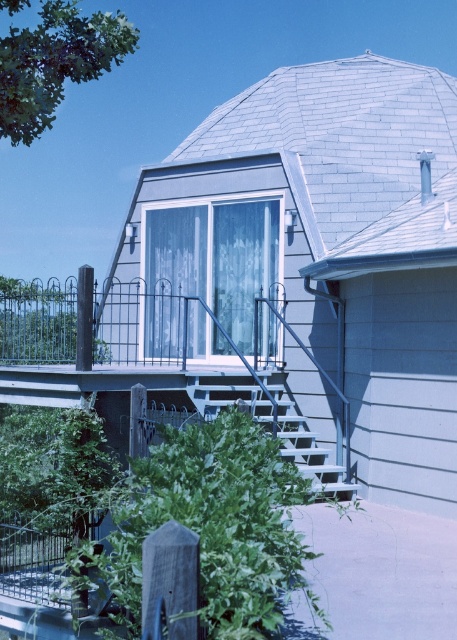
Who is shorter, metallic gray porch at center or white matte stairs at lower center?

metallic gray porch at center is shorter.

Who is more forward, (x=180, y=372) or (x=276, y=406)?

Point (x=276, y=406)

Between point (302, 445) and point (244, 396), which one is positioned in front?

Point (302, 445)

Image resolution: width=457 pixels, height=640 pixels. What are the coordinates of `metallic gray porch at center` in the screenshot? It's located at (175, 355).